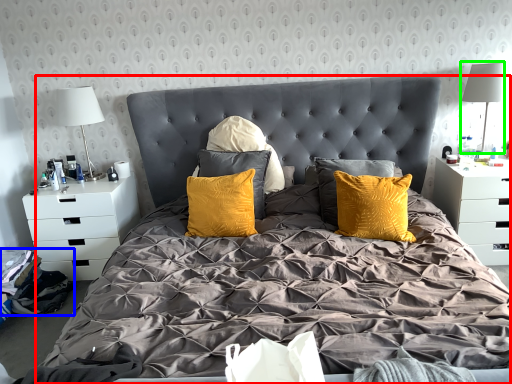
Question: Which object is the closest to the bed (highlighted by a red box)? Choose among these: material (highlighted by a blue box) or table lamp (highlighted by a green box).

Choices:
 (A) material
 (B) table lamp

Answer: (A)